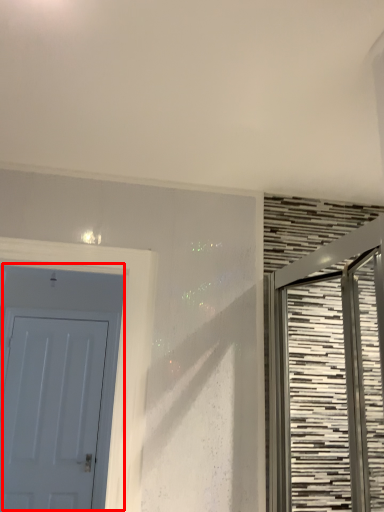
Question: From the image's perspective, what is the correct spatial relationship of door (annotated by the red box) in relation to door?

Choices:
 (A) below
 (B) above

Answer: (A)